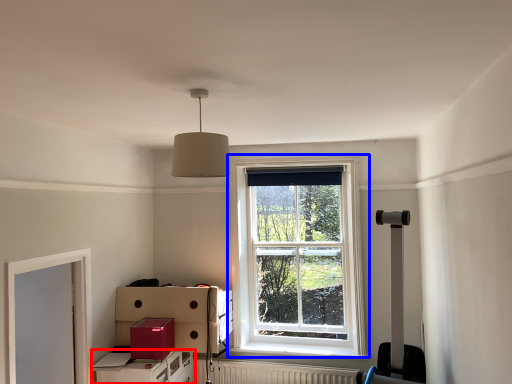
Question: Which of the following is the closest to the observer, file cabinet (highlighted by a red box) or window (highlighted by a blue box)?

Choices:
 (A) file cabinet
 (B) window

Answer: (A)